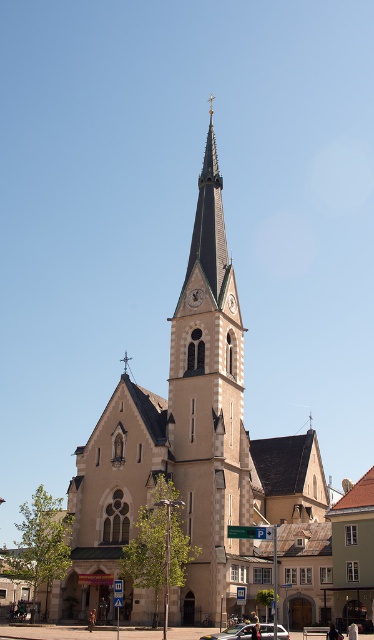
Question: Which point is closer to the camera?

Choices:
 (A) beige stone church at center
 (B) silver metallic car at center

Answer: (B)

Question: Can you confirm if beige stone church at center is smaller than silver metallic car at center?

Choices:
 (A) no
 (B) yes

Answer: (A)

Question: Does beige stone church at center appear on the left side of silver metallic car at center?

Choices:
 (A) no
 (B) yes

Answer: (A)

Question: Which of the following is the farthest from the observer?

Choices:
 (A) (172, 371)
 (B) (243, 637)

Answer: (A)

Question: Is beige stone church at center positioned at the back of silver metallic car at center?

Choices:
 (A) yes
 (B) no

Answer: (A)